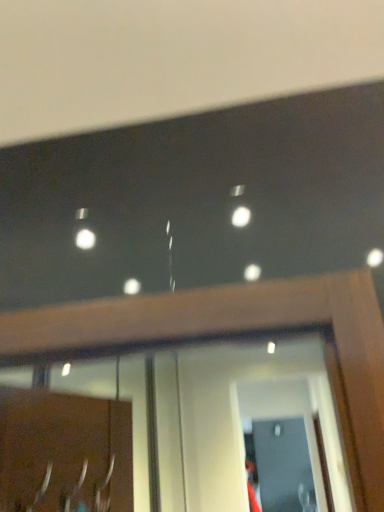
Describe the element at coordinates (282, 466) in the screenshot. I see `clear glass screen door at lower center, acting as the 2th screen door starting from the top` at that location.

Where is `silver metallic door handle at lower left`? This screenshot has height=512, width=384. silver metallic door handle at lower left is located at coordinates (43, 486).

Can you confirm if silver metallic door handle at lower left is shorter than transparent glass screen door at lower center, which appears as the first screen door when viewed from the front?

Correct, silver metallic door handle at lower left is not as tall as transparent glass screen door at lower center, which appears as the first screen door when viewed from the front.

Considering the relative positions of silver metallic door handle at lower left and transparent glass screen door at lower center, arranged as the 1th screen door when viewed from the top, in the image provided, is silver metallic door handle at lower left to the left or to the right of transparent glass screen door at lower center, arranged as the 1th screen door when viewed from the top,?

From the image, it's evident that silver metallic door handle at lower left is to the left of transparent glass screen door at lower center, arranged as the 1th screen door when viewed from the top.

Which of these two, silver metallic door handle at lower left or transparent glass screen door at lower center, which appears as the first screen door when viewed from the front, is smaller?

silver metallic door handle at lower left.

Are silver metallic door handle at lower left and transparent glass screen door at lower center, which appears as the first screen door when viewed from the front, far apart?

silver metallic door handle at lower left is positioned a significant distance from transparent glass screen door at lower center, which appears as the first screen door when viewed from the front.

Between transparent glass screen door at lower center, the second screen door positioned from the bottom, and clear glass screen door at lower center, acting as the 2th screen door starting from the top, which one has less height?

transparent glass screen door at lower center, the second screen door positioned from the bottom, is shorter.

Considering the relative sizes of transparent glass screen door at lower center, arranged as the 1th screen door when viewed from the top, and clear glass screen door at lower center, marked as the first screen door in a bottom-to-top arrangement, in the image provided, is transparent glass screen door at lower center, arranged as the 1th screen door when viewed from the top, thinner than clear glass screen door at lower center, marked as the first screen door in a bottom-to-top arrangement,?

No, transparent glass screen door at lower center, arranged as the 1th screen door when viewed from the top, is not thinner than clear glass screen door at lower center, marked as the first screen door in a bottom-to-top arrangement.

Does point (247, 401) come behind point (301, 474)?

Yes, it is.

Is transparent glass screen door at lower center, arranged as the 1th screen door when viewed from the top, behind clear glass screen door at lower center, marked as the first screen door in a bottom-to-top arrangement?

No, transparent glass screen door at lower center, arranged as the 1th screen door when viewed from the top, is in front of clear glass screen door at lower center, marked as the first screen door in a bottom-to-top arrangement.

Is silver metallic door handle at lower left taller or shorter than clear glass screen door at lower center, marked as the second screen door in a front-to-back arrangement?

Considering their sizes, silver metallic door handle at lower left has less height than clear glass screen door at lower center, marked as the second screen door in a front-to-back arrangement.

Consider the image. How different are the orientations of silver metallic door handle at lower left and clear glass screen door at lower center, acting as the 2th screen door starting from the top, in degrees?

76.1 degrees.

From the image's perspective, does silver metallic door handle at lower left appear higher than clear glass screen door at lower center, marked as the second screen door in a front-to-back arrangement?

Yes, from the image's perspective, silver metallic door handle at lower left is on top of clear glass screen door at lower center, marked as the second screen door in a front-to-back arrangement.

Considering the sizes of objects silver metallic door handle at lower left and clear glass screen door at lower center, which appears as the 1th screen door when viewed from the back, in the image provided, who is wider, silver metallic door handle at lower left or clear glass screen door at lower center, which appears as the 1th screen door when viewed from the back,?

silver metallic door handle at lower left is wider.

Is clear glass screen door at lower center, marked as the second screen door in a front-to-back arrangement, placed right next to transparent glass screen door at lower center, arranged as the 1th screen door when viewed from the top?

Yes, clear glass screen door at lower center, marked as the second screen door in a front-to-back arrangement, and transparent glass screen door at lower center, arranged as the 1th screen door when viewed from the top, clearly make contact.

From a real-world perspective, which is physically below, clear glass screen door at lower center, acting as the 2th screen door starting from the top, or transparent glass screen door at lower center, arranged as the 1th screen door when viewed from the top?

From a 3D spatial view, clear glass screen door at lower center, acting as the 2th screen door starting from the top, is below.

Considering the sizes of clear glass screen door at lower center, marked as the second screen door in a front-to-back arrangement, and transparent glass screen door at lower center, the second screen door positioned from the bottom, in the image, is clear glass screen door at lower center, marked as the second screen door in a front-to-back arrangement, wider or thinner than transparent glass screen door at lower center, the second screen door positioned from the bottom,?

clear glass screen door at lower center, marked as the second screen door in a front-to-back arrangement, is thinner than transparent glass screen door at lower center, the second screen door positioned from the bottom.

Is clear glass screen door at lower center, which appears as the 1th screen door when viewed from the back, taller or shorter than transparent glass screen door at lower center, which is counted as the second screen door, starting from the back?

Considering their sizes, clear glass screen door at lower center, which appears as the 1th screen door when viewed from the back, has more height than transparent glass screen door at lower center, which is counted as the second screen door, starting from the back.

From a real-world perspective, is clear glass screen door at lower center, acting as the 2th screen door starting from the top, located beneath silver metallic door handle at lower left?

Yes, from a real-world perspective, clear glass screen door at lower center, acting as the 2th screen door starting from the top, is under silver metallic door handle at lower left.

Consider the image. Is silver metallic door handle at lower left at the back of clear glass screen door at lower center, which appears as the 1th screen door when viewed from the back?

No.

Considering the relative sizes of clear glass screen door at lower center, marked as the first screen door in a bottom-to-top arrangement, and silver metallic door handle at lower left in the image provided, is clear glass screen door at lower center, marked as the first screen door in a bottom-to-top arrangement, taller than silver metallic door handle at lower left?

Indeed, clear glass screen door at lower center, marked as the first screen door in a bottom-to-top arrangement, has a greater height compared to silver metallic door handle at lower left.

In the scene shown: Can silver metallic door handle at lower left be found inside transparent glass screen door at lower center, which appears as the first screen door when viewed from the front?

No, silver metallic door handle at lower left is located outside of transparent glass screen door at lower center, which appears as the first screen door when viewed from the front.

Could you tell me if transparent glass screen door at lower center, which is counted as the second screen door, starting from the back, is turned towards silver metallic door handle at lower left?

Yes, transparent glass screen door at lower center, which is counted as the second screen door, starting from the back, is aimed at silver metallic door handle at lower left.

From a real-world perspective, which object stands above the other?

silver metallic door handle at lower left is physically above.

Which screen door is the 1st one when counting from the right side of the silver metallic door handle at lower left? Please provide its 2D coordinates.

[(283, 446)]

You are a GUI agent. You are given a task and a screenshot of the screen. Output one action in this format:
    pyautogui.click(x=<x>, y=<y>)
    Task: Click on the screen door lying in front of the clear glass screen door at lower center, marked as the first screen door in a bottom-to-top arrangement
    This screenshot has height=512, width=384.
    Given the screenshot: What is the action you would take?
    pyautogui.click(x=283, y=446)

Estimate the real-world distances between objects in this image. Which object is closer to clear glass screen door at lower center, marked as the second screen door in a front-to-back arrangement, silver metallic door handle at lower left or transparent glass screen door at lower center, which is counted as the second screen door, starting from the back?

transparent glass screen door at lower center, which is counted as the second screen door, starting from the back.

Estimate the real-world distances between objects in this image. Which object is closer to clear glass screen door at lower center, marked as the second screen door in a front-to-back arrangement, transparent glass screen door at lower center, arranged as the 1th screen door when viewed from the top, or silver metallic door handle at lower left?

Based on the image, transparent glass screen door at lower center, arranged as the 1th screen door when viewed from the top, appears to be nearer to clear glass screen door at lower center, marked as the second screen door in a front-to-back arrangement.

Which object lies further to the anchor point transparent glass screen door at lower center, which is counted as the second screen door, starting from the back, clear glass screen door at lower center, which appears as the 1th screen door when viewed from the back, or silver metallic door handle at lower left?

silver metallic door handle at lower left is positioned further to the anchor transparent glass screen door at lower center, which is counted as the second screen door, starting from the back.

Looking at the image, which one is located closer to silver metallic door handle at lower left, clear glass screen door at lower center, marked as the second screen door in a front-to-back arrangement, or transparent glass screen door at lower center, arranged as the 1th screen door when viewed from the top?

transparent glass screen door at lower center, arranged as the 1th screen door when viewed from the top.

Considering their positions, is transparent glass screen door at lower center, arranged as the 1th screen door when viewed from the top, positioned closer to silver metallic door handle at lower left than clear glass screen door at lower center, marked as the first screen door in a bottom-to-top arrangement?

transparent glass screen door at lower center, arranged as the 1th screen door when viewed from the top, is closer to silver metallic door handle at lower left.

Looking at the image, which one is located closer to transparent glass screen door at lower center, the second screen door positioned from the bottom, silver metallic door handle at lower left or clear glass screen door at lower center, which appears as the 1th screen door when viewed from the back?

clear glass screen door at lower center, which appears as the 1th screen door when viewed from the back.

Where is `screen door between silver metallic door handle at lower left and clear glass screen door at lower center, marked as the first screen door in a bottom-to-top arrangement, along the z-axis`? The width and height of the screenshot is (384, 512). screen door between silver metallic door handle at lower left and clear glass screen door at lower center, marked as the first screen door in a bottom-to-top arrangement, along the z-axis is located at coordinates (283, 446).